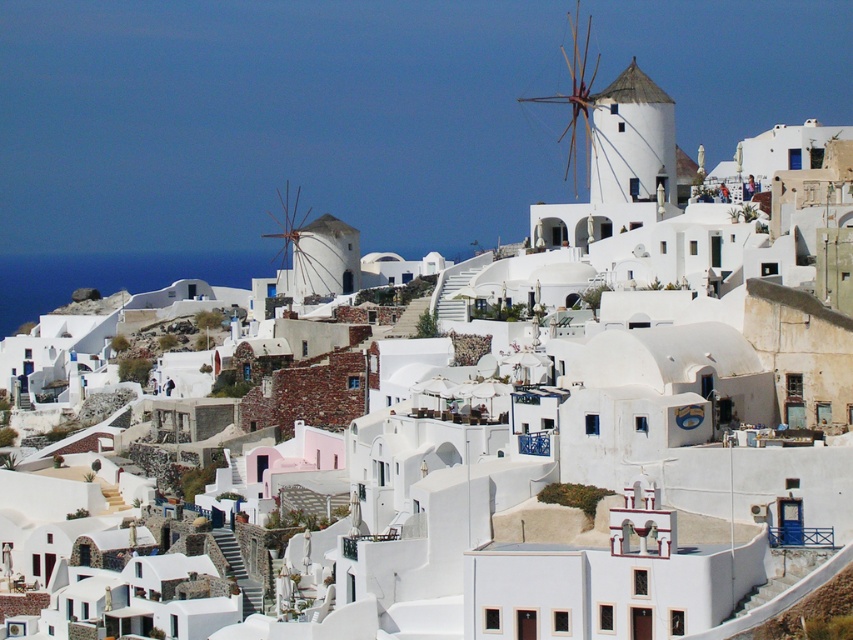
Does white matte windmill at center have a greater height compared to white wooden windmill at upper center?

No.

Find the location of a particular element. The height and width of the screenshot is (640, 853). white matte windmill at center is located at coordinates (317, 252).

Where is `white matte windmill at center`? The width and height of the screenshot is (853, 640). white matte windmill at center is located at coordinates (317, 252).